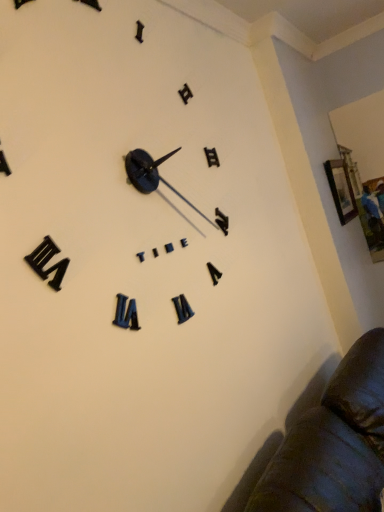
Question: From a real-world perspective, does wooden picture frame at upper right sit lower than black matte clock at upper center?

Choices:
 (A) no
 (B) yes

Answer: (B)

Question: Considering the relative sizes of wooden picture frame at upper right and black matte clock at upper center in the image provided, is wooden picture frame at upper right shorter than black matte clock at upper center?

Choices:
 (A) yes
 (B) no

Answer: (A)

Question: Could you tell me if wooden picture frame at upper right is turned towards black matte clock at upper center?

Choices:
 (A) no
 (B) yes

Answer: (A)

Question: Is wooden picture frame at upper right at the right side of black matte clock at upper center?

Choices:
 (A) yes
 (B) no

Answer: (A)

Question: Considering the relative positions of wooden picture frame at upper right and black matte clock at upper center in the image provided, is wooden picture frame at upper right to the left of black matte clock at upper center from the viewer's perspective?

Choices:
 (A) no
 (B) yes

Answer: (A)

Question: Is wooden picture frame at upper right oriented away from black matte clock at upper center?

Choices:
 (A) no
 (B) yes

Answer: (A)

Question: Is black matte clock at upper center at the left side of wooden picture frame at upper right?

Choices:
 (A) yes
 (B) no

Answer: (A)

Question: From the image's perspective, does black matte clock at upper center appear lower than wooden picture frame at upper right?

Choices:
 (A) no
 (B) yes

Answer: (B)

Question: Is black matte clock at upper center oriented away from wooden picture frame at upper right?

Choices:
 (A) no
 (B) yes

Answer: (A)

Question: Can you confirm if black matte clock at upper center is bigger than wooden picture frame at upper right?

Choices:
 (A) no
 (B) yes

Answer: (B)

Question: Is black matte clock at upper center wider than wooden picture frame at upper right?

Choices:
 (A) no
 (B) yes

Answer: (B)

Question: Does black matte clock at upper center come behind wooden picture frame at upper right?

Choices:
 (A) no
 (B) yes

Answer: (A)

Question: From a real-world perspective, relative to black matte clock at upper center, is wooden picture frame at upper right vertically above or below?

Choices:
 (A) above
 (B) below

Answer: (B)